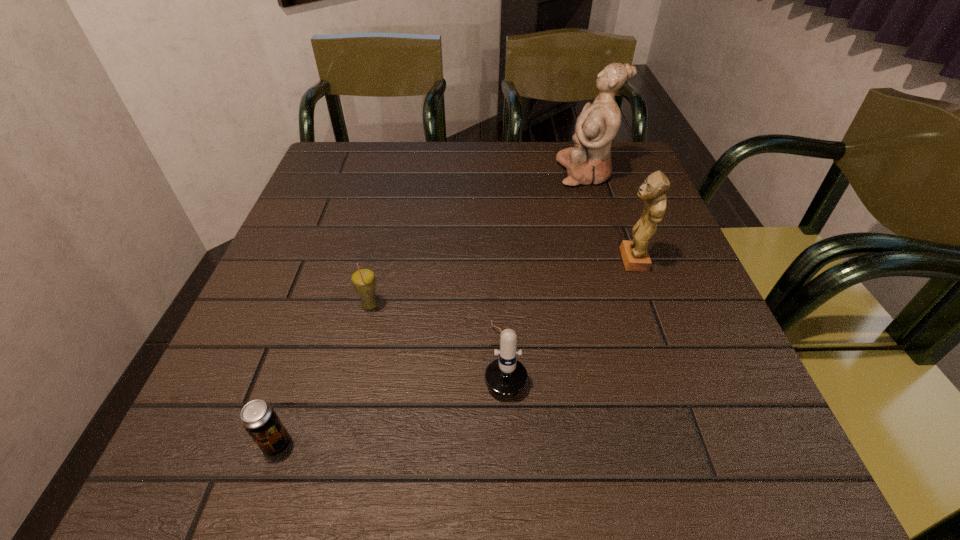
At what (x,y) coordinates should I click in order to perform the action: click on vacant space situated 0.310m on the front-facing side of the tallest object. Please return your answer as a coordinate pair (x, y). The width and height of the screenshot is (960, 540). Looking at the image, I should click on (441, 173).

Where is `vacant space located on the front-facing side of the tallest object`? The image size is (960, 540). vacant space located on the front-facing side of the tallest object is located at coordinates (509, 173).

Find the location of a particular element. Image resolution: width=960 pixels, height=540 pixels. free location located 0.300m on the front-facing side of the tallest object is located at coordinates (444, 173).

Where is `blank area located 0.180m on the front-facing side of the fourth nearest object`? The image size is (960, 540). blank area located 0.180m on the front-facing side of the fourth nearest object is located at coordinates (532, 260).

The height and width of the screenshot is (540, 960). I want to click on vacant space located on the front-facing side of the fourth nearest object, so click(513, 260).

Find the location of a particular element. free space located 0.360m on the front-facing side of the fourth nearest object is located at coordinates (446, 260).

At what (x,y) coordinates should I click in order to perform the action: click on free spot located 0.390m on the back of the straw for drinking. Please return your answer as a coordinate pair (x, y). Looking at the image, I should click on (398, 185).

This screenshot has height=540, width=960. Identify the location of vacant space situated on the right of the fourth farthest object. (577, 359).

I want to click on vacant space located 0.170m on the right of the shortest object, so click(407, 444).

Identify the location of object that is at the far edge. (589, 161).